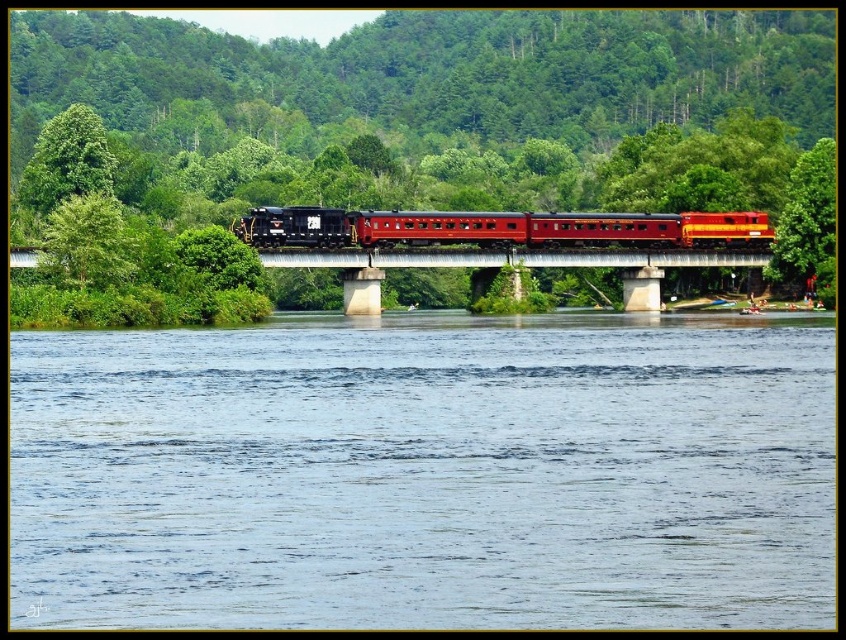
Question: Which object is positioned closest to the concrete bridge at center?

Choices:
 (A) clear blue water at center
 (B) metallic red train at center

Answer: (B)

Question: Which point is closer to the camera taking this photo?

Choices:
 (A) (454, 227)
 (B) (823, 396)
 (C) (722, 262)

Answer: (B)

Question: Is clear blue water at center to the right of concrete bridge at center from the viewer's perspective?

Choices:
 (A) yes
 (B) no

Answer: (B)

Question: Is metallic red train at center positioned at the back of concrete bridge at center?

Choices:
 (A) no
 (B) yes

Answer: (B)

Question: Which object is farther from the camera taking this photo?

Choices:
 (A) clear blue water at center
 (B) concrete bridge at center
 (C) metallic red train at center

Answer: (C)

Question: Where is clear blue water at center located in relation to concrete bridge at center in the image?

Choices:
 (A) above
 (B) below

Answer: (B)